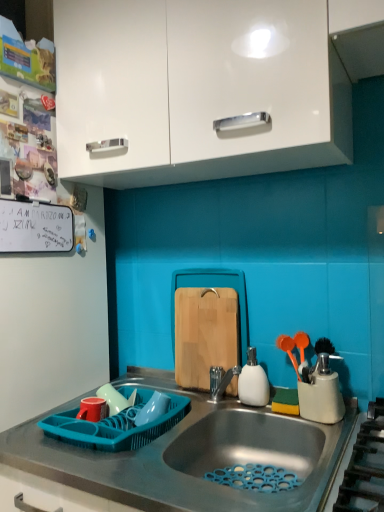
Question: Based on their positions, is gray matte countertop at center located to the left or right of white matte soap dispenser at sink, which ranks as the first appliance in right-to-left order?

Choices:
 (A) left
 (B) right

Answer: (A)

Question: Considering the positions of gray matte countertop at center and white matte soap dispenser at sink, which ranks as the first appliance in right-to-left order, in the image, is gray matte countertop at center taller or shorter than white matte soap dispenser at sink, which ranks as the first appliance in right-to-left order,?

Choices:
 (A) short
 (B) tall

Answer: (B)

Question: Which object is positioned farthest from the white glossy cabinet at upper center?

Choices:
 (A) white magnetic at left
 (B) white matte soap dispenser at sink, which is the 2th appliance in left-to-right order
 (C) gray matte countertop at center
 (D) teal plastic dish rack at lower left, placed as the 2th appliance when sorted from right to left
 (E) natural wood cutting board at center

Answer: (C)

Question: Which of these objects is positioned closest to the gray matte countertop at center?

Choices:
 (A) natural wood cutting board at center
 (B) white magnetic at left
 (C) teal plastic dish rack at lower left, positioned as the 2th appliance in top-to-bottom order
 (D) white matte soap dispenser at sink, which is counted as the first appliance, starting from the top
 (E) white glossy cabinet at upper center

Answer: (C)